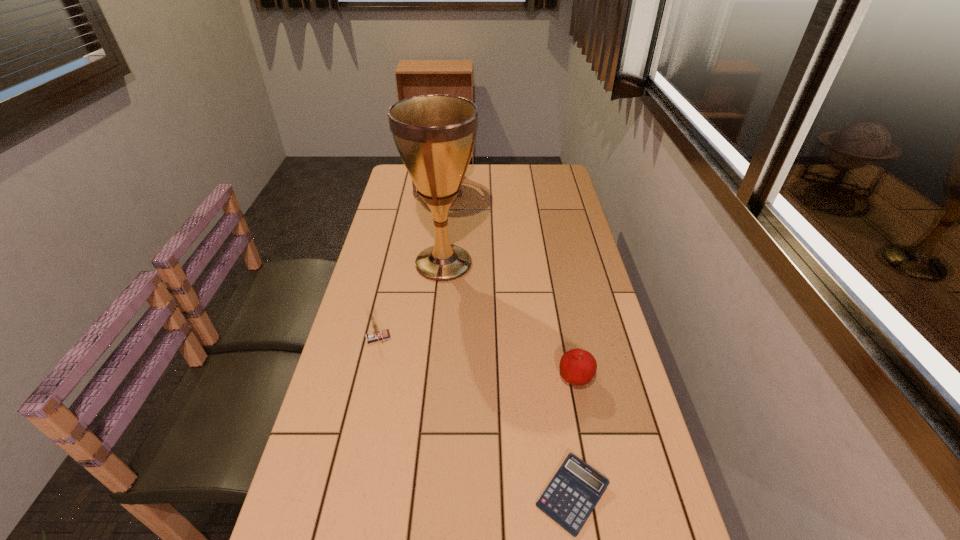
Locate an element on the screen. The height and width of the screenshot is (540, 960). calculator that is at the right edge is located at coordinates (572, 494).

Where is `object situated at the far left corner`? This screenshot has height=540, width=960. object situated at the far left corner is located at coordinates (415, 194).

Find the location of `free space at the far edge`. free space at the far edge is located at coordinates (473, 186).

Locate an element on the screen. The width and height of the screenshot is (960, 540). free spot at the left edge of the desktop is located at coordinates (355, 495).

The image size is (960, 540). In the image, there is a desktop. Find the location of `vacant space at the right edge`. vacant space at the right edge is located at coordinates (617, 415).

The height and width of the screenshot is (540, 960). Find the location of `blank space at the far right corner`. blank space at the far right corner is located at coordinates (567, 180).

The width and height of the screenshot is (960, 540). In order to click on unoccupied area between the third shortest object and the second farthest object in this screenshot , I will do `click(411, 301)`.

Where is `free space between the apple and the globe`? The height and width of the screenshot is (540, 960). free space between the apple and the globe is located at coordinates (x=507, y=282).

Locate an element on the screen. Image resolution: width=960 pixels, height=540 pixels. unoccupied area between the trophy cup and the shortest object is located at coordinates (508, 379).

The image size is (960, 540). Find the location of `free space between the trophy cup and the matchbox`. free space between the trophy cup and the matchbox is located at coordinates (411, 301).